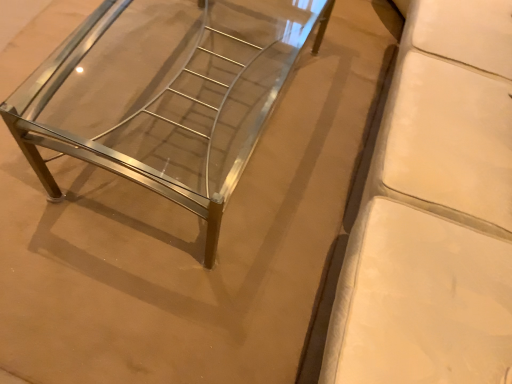
Question: Based on their positions, is polished chrome bench at center, which is the second furniture from right to left, located to the left or right of white leather couch at right, the first furniture when ordered from right to left?

Choices:
 (A) left
 (B) right

Answer: (A)

Question: Would you say polished chrome bench at center, which is the second furniture from right to left, is inside or outside white leather couch at right, acting as the 2th furniture starting from the left?

Choices:
 (A) inside
 (B) outside

Answer: (B)

Question: Is point (159, 155) positioned closer to the camera than point (409, 342)?

Choices:
 (A) closer
 (B) farther

Answer: (B)

Question: Does point (404, 109) appear closer or farther from the camera than point (99, 54)?

Choices:
 (A) farther
 (B) closer

Answer: (B)

Question: In terms of height, does white leather couch at right, the first furniture when ordered from right to left, look taller or shorter compared to polished chrome bench at center, which is the second furniture from right to left?

Choices:
 (A) short
 (B) tall

Answer: (B)

Question: Based on their positions, is white leather couch at right, acting as the 2th furniture starting from the left, located to the left or right of polished chrome bench at center, which is the second furniture from right to left?

Choices:
 (A) right
 (B) left

Answer: (A)

Question: Looking at their shapes, would you say white leather couch at right, the first furniture when ordered from right to left, is wider or thinner than polished chrome bench at center, which is the second furniture from right to left?

Choices:
 (A) thin
 (B) wide

Answer: (B)